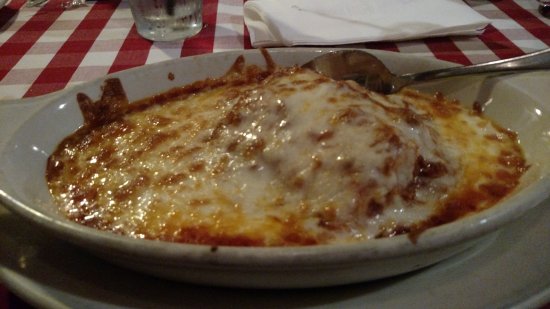
Locate an element on the screen. spoon handle is located at coordinates (495, 67).